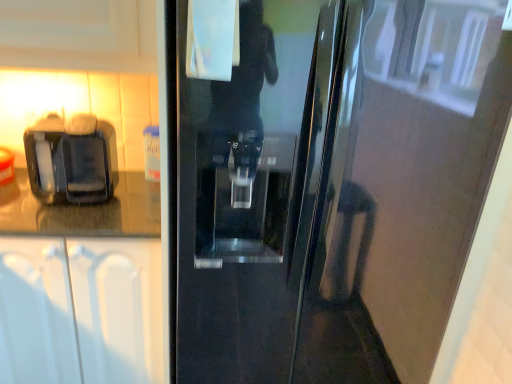
In order to click on free space in front of black plastic coffee machine at left in this screenshot , I will do `click(55, 218)`.